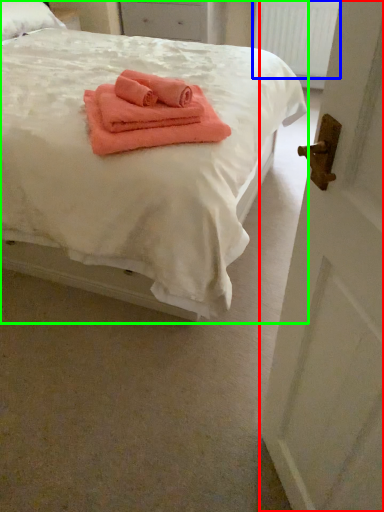
Question: Which object is positioned farthest from door (highlighted by a red box)? Select from radiator (highlighted by a blue box) and bed (highlighted by a green box).

Choices:
 (A) radiator
 (B) bed

Answer: (A)